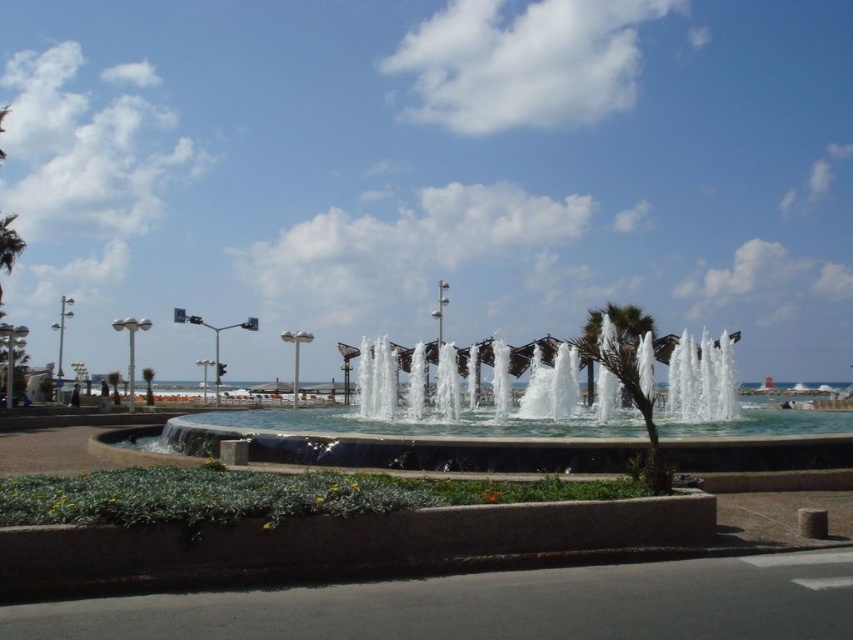
Question: Which object is closer to the camera taking this photo?

Choices:
 (A) concrete fountain at center
 (B) green leafy palm tree at center

Answer: (B)

Question: Which of the following is the farthest from the observer?

Choices:
 (A) (302, 436)
 (B) (616, 308)

Answer: (B)

Question: Which point is farther from the camera taking this photo?

Choices:
 (A) (671, 444)
 (B) (619, 307)

Answer: (B)

Question: From the image, what is the correct spatial relationship of concrete fountain at center in relation to green leafy palm tree at center?

Choices:
 (A) right
 (B) left

Answer: (B)

Question: Where is concrete fountain at center located in relation to green leafy palm tree at center in the image?

Choices:
 (A) right
 (B) left

Answer: (B)

Question: Can you confirm if concrete fountain at center is positioned below green leafy palm tree at center?

Choices:
 (A) no
 (B) yes

Answer: (B)